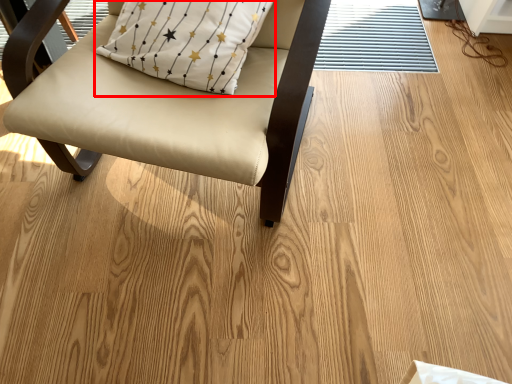
Question: From the image's perspective, what is the correct spatial positioning of pillow (annotated by the red box) in reference to chair?

Choices:
 (A) below
 (B) above

Answer: (B)